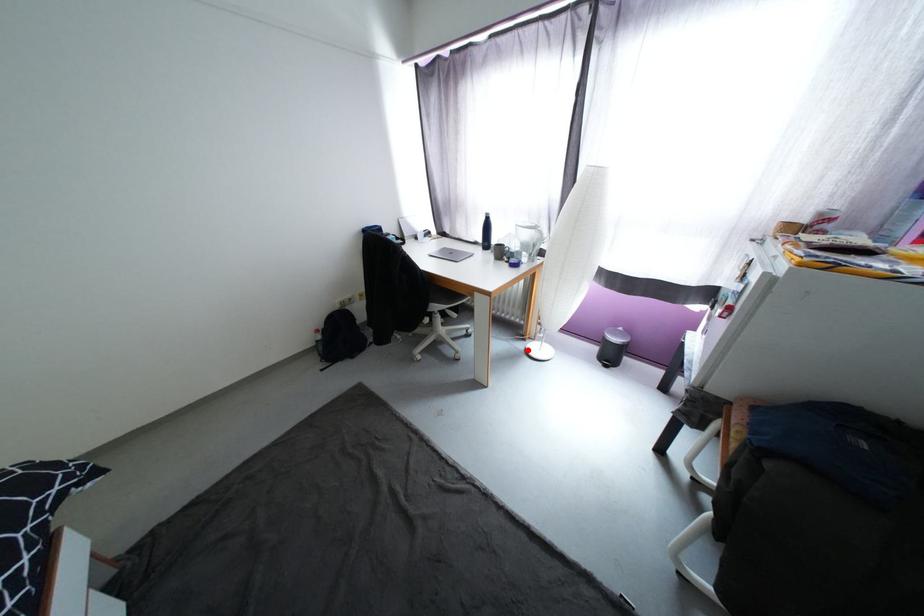
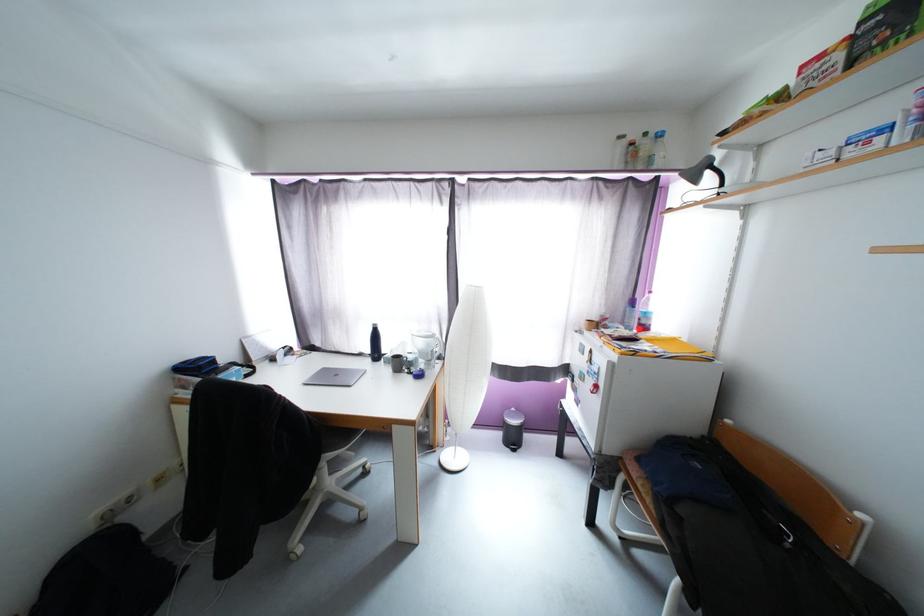
Locate, in the second image, the point that corresponds to the highlighted location in the first image.

(442, 464)